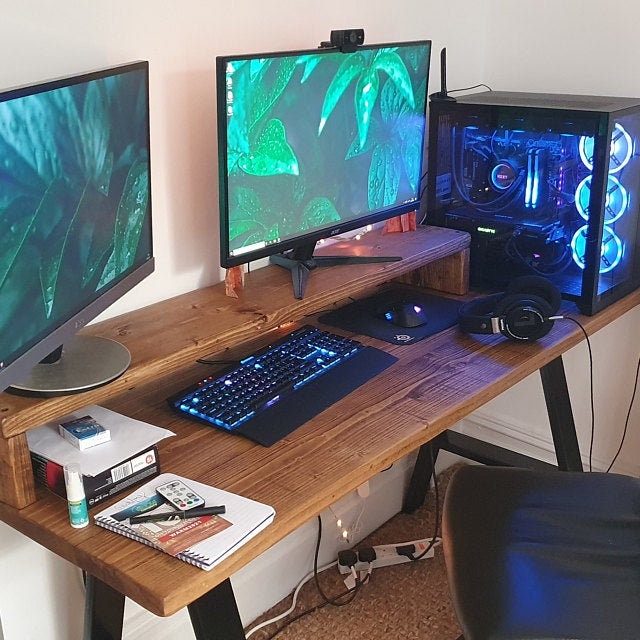
This screenshot has height=640, width=640. Identify the location of monitor. (308, 168), (36, 262).